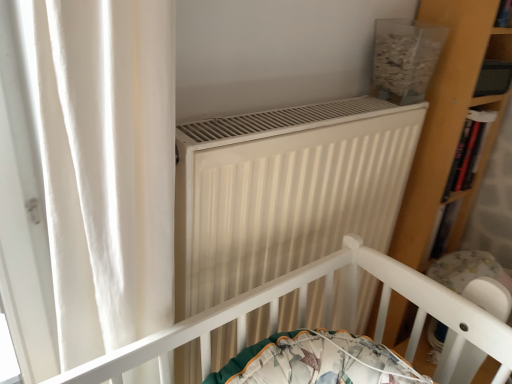
Question: From the image's perspective, would you say white plastic baby carriage at lower right is shown under white matte radiator at center?

Choices:
 (A) no
 (B) yes

Answer: (B)

Question: Is white plastic baby carriage at lower right to the left of white matte radiator at center from the viewer's perspective?

Choices:
 (A) no
 (B) yes

Answer: (A)

Question: Does white plastic baby carriage at lower right have a greater width compared to white matte radiator at center?

Choices:
 (A) yes
 (B) no

Answer: (A)

Question: Considering the relative positions of white plastic baby carriage at lower right and white matte radiator at center in the image provided, is white plastic baby carriage at lower right to the right of white matte radiator at center from the viewer's perspective?

Choices:
 (A) no
 (B) yes

Answer: (B)

Question: Considering the relative sizes of white plastic baby carriage at lower right and white matte radiator at center in the image provided, is white plastic baby carriage at lower right shorter than white matte radiator at center?

Choices:
 (A) no
 (B) yes

Answer: (B)

Question: From the image's perspective, is white matte radiator at center positioned above or below white plastic baby carriage at lower right?

Choices:
 (A) below
 (B) above

Answer: (B)

Question: Choose the correct answer: Is white matte radiator at center inside white plastic baby carriage at lower right or outside it?

Choices:
 (A) outside
 (B) inside

Answer: (A)

Question: In terms of height, does white matte radiator at center look taller or shorter compared to white plastic baby carriage at lower right?

Choices:
 (A) short
 (B) tall

Answer: (B)

Question: Based on their sizes in the image, would you say white matte radiator at center is bigger or smaller than white plastic baby carriage at lower right?

Choices:
 (A) big
 (B) small

Answer: (A)

Question: Looking at the image, does white plastic baby carriage at lower right seem bigger or smaller compared to wooden bookshelf at right?

Choices:
 (A) big
 (B) small

Answer: (A)

Question: Considering the relative positions of white plastic baby carriage at lower right and wooden bookshelf at right in the image provided, is white plastic baby carriage at lower right to the left or to the right of wooden bookshelf at right?

Choices:
 (A) left
 (B) right

Answer: (B)

Question: From a real-world perspective, is white plastic baby carriage at lower right positioned above or below wooden bookshelf at right?

Choices:
 (A) below
 (B) above

Answer: (A)

Question: From the image's perspective, is white plastic baby carriage at lower right located above or below wooden bookshelf at right?

Choices:
 (A) below
 (B) above

Answer: (A)

Question: Would you say white matte radiator at center is inside or outside wooden bookshelf at right?

Choices:
 (A) inside
 (B) outside

Answer: (B)

Question: From their relative heights in the image, would you say white matte radiator at center is taller or shorter than wooden bookshelf at right?

Choices:
 (A) tall
 (B) short

Answer: (A)